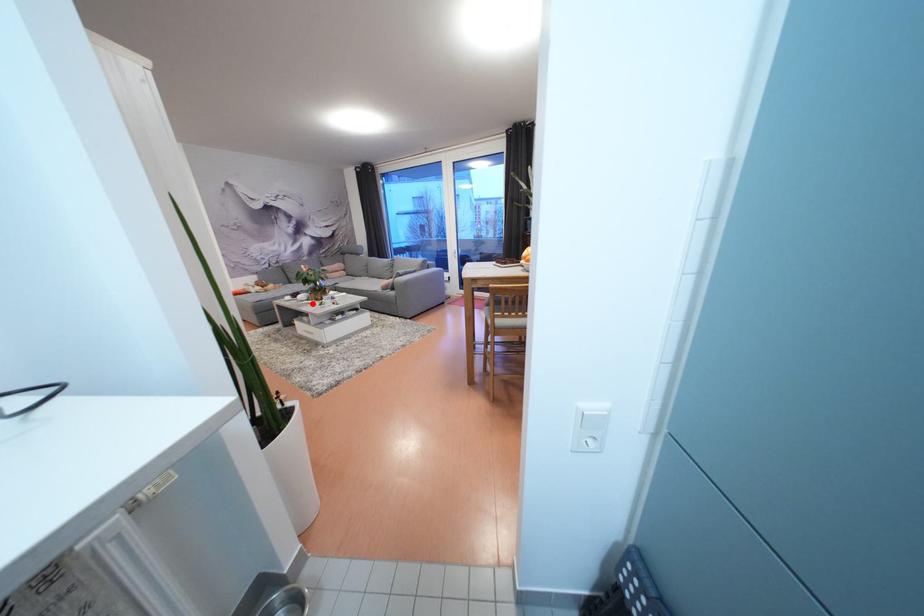
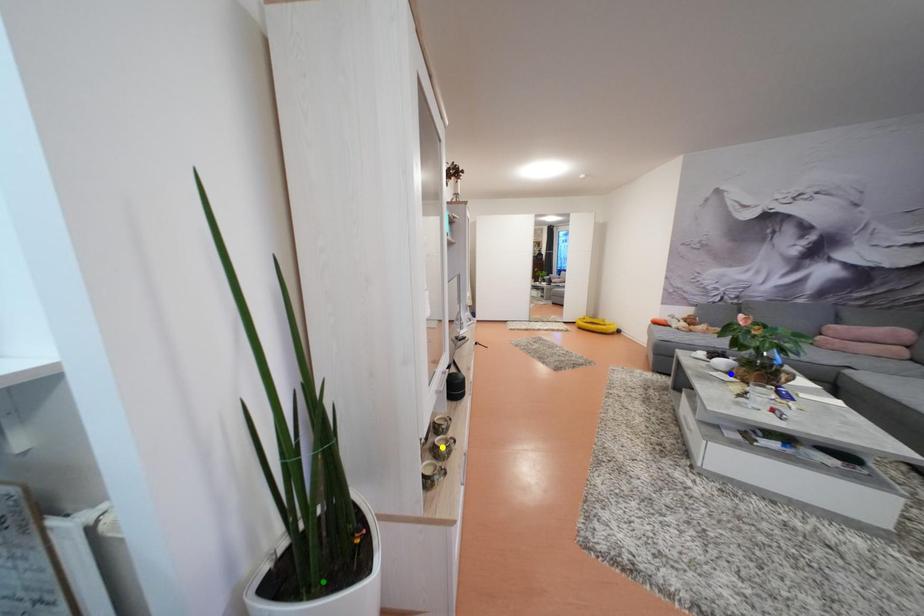
Question: I am providing you with two images of the same scene from different viewpoints. A red point is marked on the first image. You are given multiple points on the second image. Which point in image 2 represents the same 3d spot as the red point in image 1?

Choices:
 (A) blue point
 (B) yellow point
 (C) green point

Answer: (A)